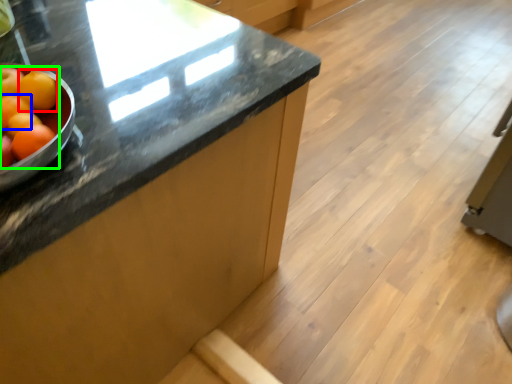
Question: Which object is the closest to the tangerine (highlighted by a red box)? Choose among these: orange (highlighted by a blue box) or grapefruit (highlighted by a green box).

Choices:
 (A) orange
 (B) grapefruit

Answer: (B)